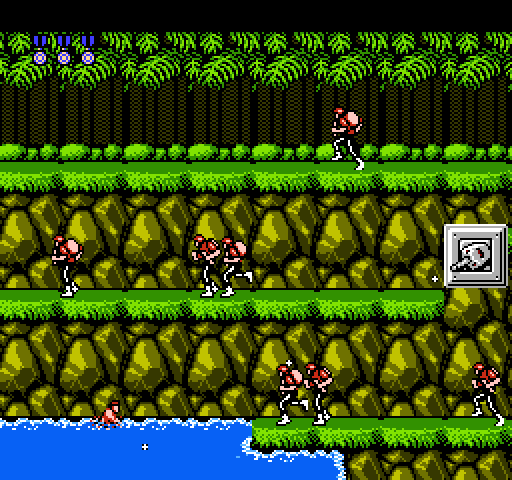
At what (x,y) coordinates should I click in order to perform the action: click on computer. Please return your answer as a coordinate pair (x, y). This screenshot has height=480, width=512. Looking at the image, I should click on (343, 386).